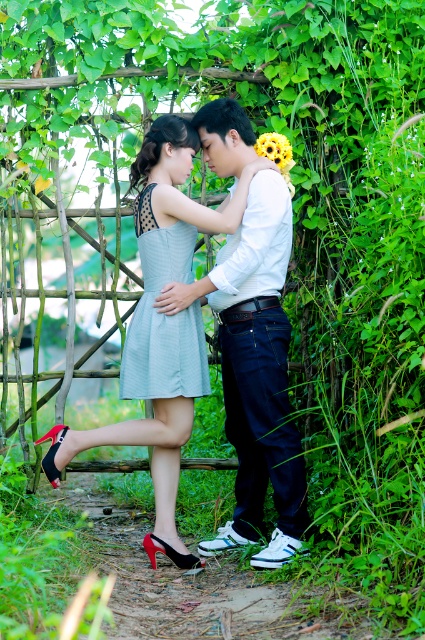
Based on the photo, based on the scene description, where is the white smooth shirt at center located in terms of coordinates?

The white smooth shirt at center is located at coordinates point (257, 372).

Looking at this image, you are a photographer aiming to capture a portrait of the light blue fabric dress at center and the yellow matte flower at upper center. Which object should you focus on first to ensure both are in sharp focus?

The light blue fabric dress at center is in front of the yellow matte flower at upper center, so you should focus on the light blue fabric dress at center first to ensure both are in sharp focus.

You are a photographer standing at a distance of 15 feet from the scene. You want to take a closeup shot of the white smooth shirt at center. Is the current distance sufficient for a clear closeup?

The white smooth shirt at center is 13.91 feet away from the camera, which is within the 15 feet distance you are standing. Therefore, the current distance is sufficient for a clear closeup.